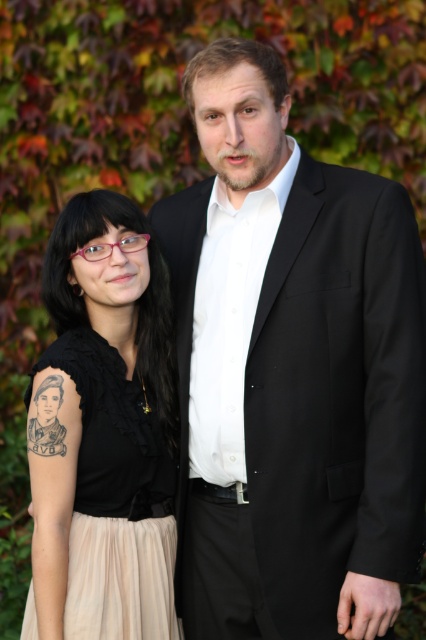
Question: Is black smooth suit at center below black matte tattoo at left?

Choices:
 (A) yes
 (B) no

Answer: (B)

Question: Which point appears closest to the camera in this image?

Choices:
 (A) (75, 529)
 (B) (267, 467)

Answer: (B)

Question: Is black smooth suit at center to the right of black matte tattoo at left from the viewer's perspective?

Choices:
 (A) yes
 (B) no

Answer: (A)

Question: Which object appears closest to the camera in this image?

Choices:
 (A) black smooth suit at center
 (B) black matte tattoo at left

Answer: (A)

Question: Can you confirm if black smooth suit at center is smaller than black matte tattoo at left?

Choices:
 (A) no
 (B) yes

Answer: (A)